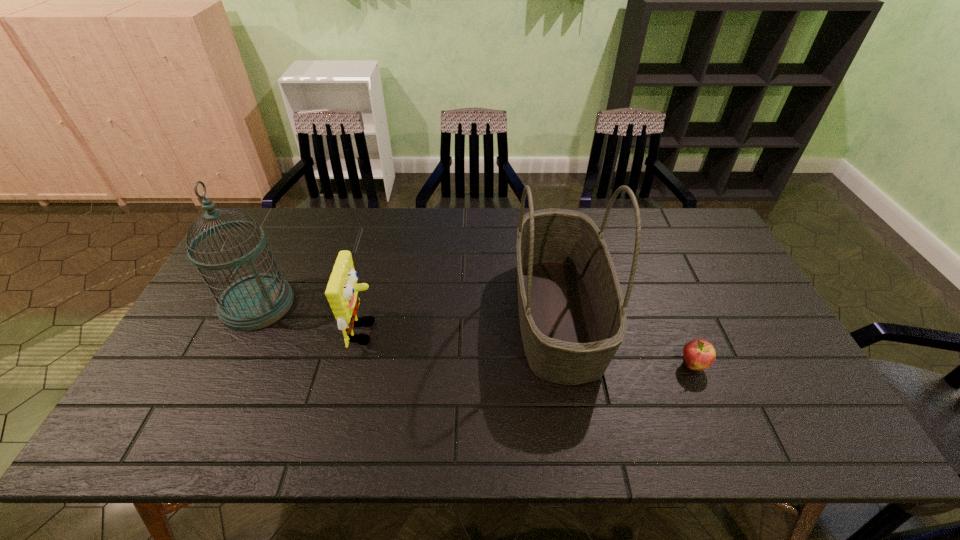
Find the location of a particular element. free space that satisfies the following two spatial constraints: 1. on the front-facing side of the leftmost object; 2. on the back side of the shortest object is located at coordinates (228, 366).

At what (x,y) coordinates should I click in order to perform the action: click on free space that satisfies the following two spatial constraints: 1. on the front-facing side of the leftmost object; 2. on the left side of the second object from right to left. Please return your answer as a coordinate pair (x, y). The image size is (960, 540). Looking at the image, I should click on (252, 314).

In order to click on blank space that satisfies the following two spatial constraints: 1. on the back side of the apple; 2. on the front-facing side of the leftmost object in this screenshot , I will do [667, 304].